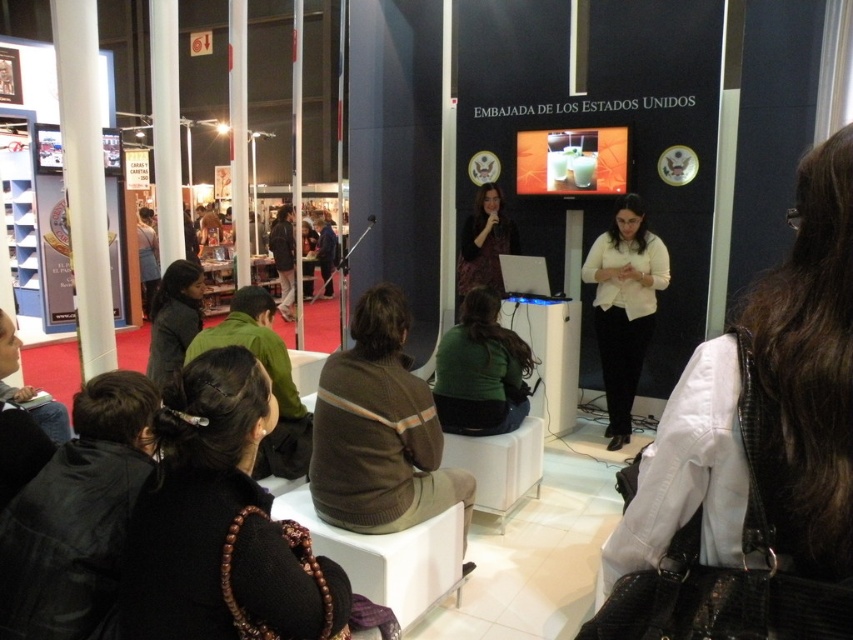
Question: Can you confirm if dark brown leather jacket at lower left is positioned below shiny purple dress at center?

Choices:
 (A) no
 (B) yes

Answer: (B)

Question: Among these points, which one is farthest from the camera?

Choices:
 (A) (467, 321)
 (B) (291, 541)

Answer: (A)

Question: Which point appears farthest from the camera in this image?

Choices:
 (A) (253, 550)
 (B) (850, 536)

Answer: (A)

Question: Is dark brown leather jacket at lower left smaller than dark gray sweater at lower left?

Choices:
 (A) no
 (B) yes

Answer: (B)

Question: Among these objects, which one is farthest from the camera?

Choices:
 (A) green matte sweater at center
 (B) dark brown leather jacket at lower left

Answer: (A)

Question: Can you confirm if dark gray sweater at lower left is positioned above shiny purple dress at center?

Choices:
 (A) no
 (B) yes

Answer: (A)